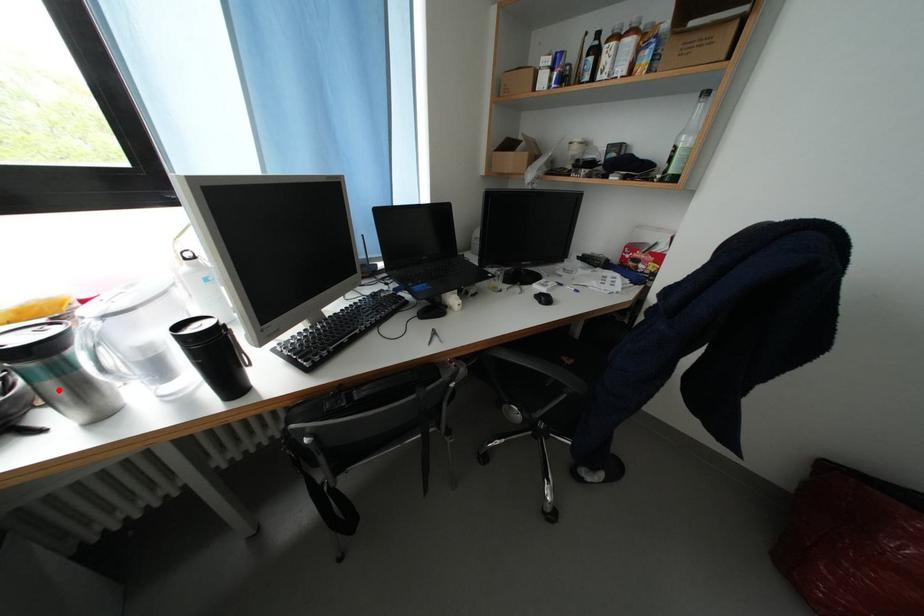
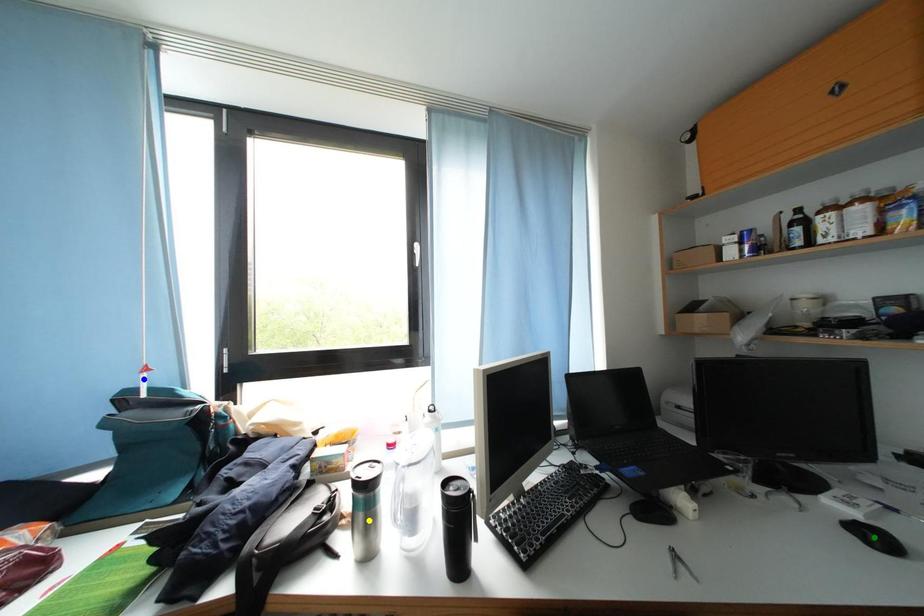
Question: I am providing you with two images of the same scene from different viewpoints. A red point is marked on the first image. You are given multiple points on the second image. Can you choose the point in image 2 that corresponds to the point in image 1?

Choices:
 (A) blue point
 (B) green point
 (C) yellow point

Answer: (C)